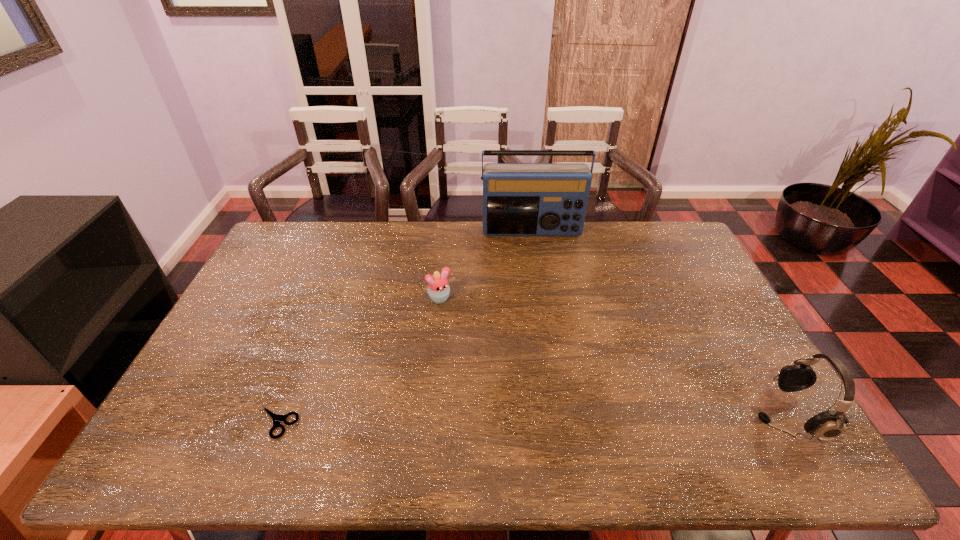
Choose which object is the second nearest neighbor to the second farthest object. Please provide its 2D coordinates. Your answer should be formatted as a tuple, i.e. [(x, y)], where the tuple contains the x and y coordinates of a point satisfying the conditions above.

[(276, 418)]

The width and height of the screenshot is (960, 540). What are the coordinates of `free space that satisfies the following two spatial constraints: 1. on the back side of the headset; 2. with the microphone on the side of the leftmost object` in the screenshot? It's located at (280, 414).

Locate an element on the screen. The width and height of the screenshot is (960, 540). free location that satisfies the following two spatial constraints: 1. on the back side of the shears; 2. with the microphone on the side of the rightmost object is located at coordinates (280, 414).

Locate an element on the screen. vacant space that satisfies the following two spatial constraints: 1. on the back side of the headset; 2. with the microphone on the side of the leftmost object is located at coordinates (280, 414).